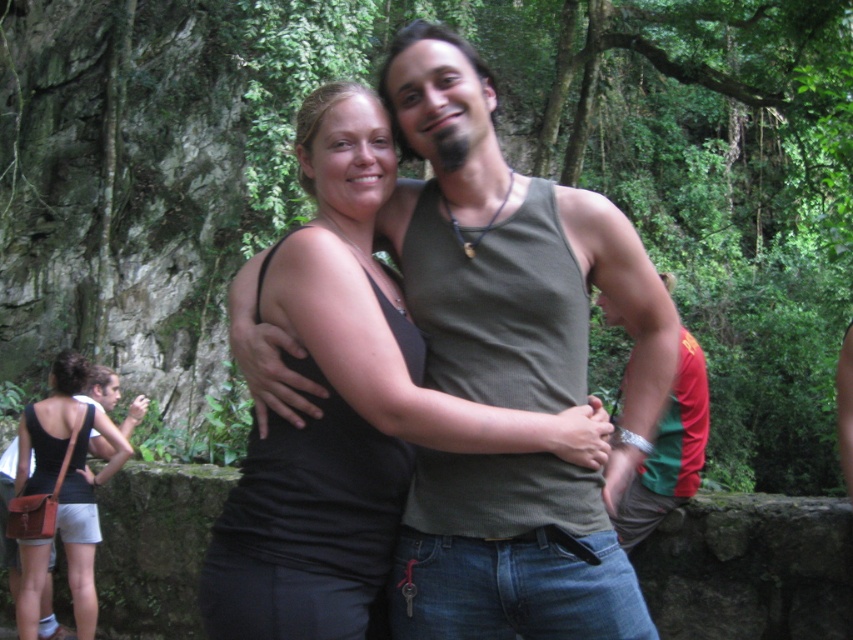
Question: Which of the following is the closest to the observer?

Choices:
 (A) (653, 467)
 (B) (643, 259)
 (C) (44, 541)

Answer: (B)

Question: Does matte green tank top at center have a smaller size compared to green fabric shirt at right?

Choices:
 (A) yes
 (B) no

Answer: (A)

Question: Which object appears farthest from the camera in this image?

Choices:
 (A) green fabric shirt at right
 (B) matte green tank top at center

Answer: (A)

Question: Can you confirm if matte green tank top at center is thinner than black fabric tank top at left?

Choices:
 (A) yes
 (B) no

Answer: (B)

Question: Among these points, which one is nearest to the camera?

Choices:
 (A) (657, 433)
 (B) (641, 312)
 (C) (22, 605)

Answer: (B)

Question: Does matte green tank top at center appear over green fabric shirt at right?

Choices:
 (A) no
 (B) yes

Answer: (B)